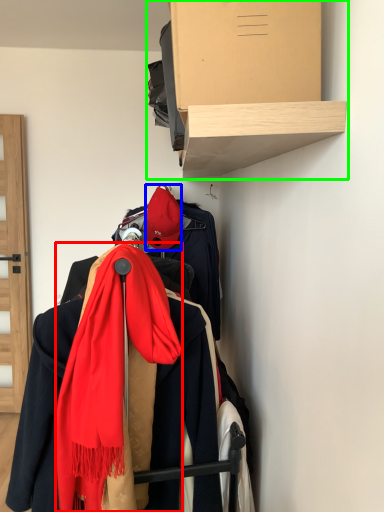
Question: Which object is the farthest from scarf (highlighted by a red box)? Choose among these: hat (highlighted by a blue box) or shelf (highlighted by a green box).

Choices:
 (A) hat
 (B) shelf

Answer: (A)